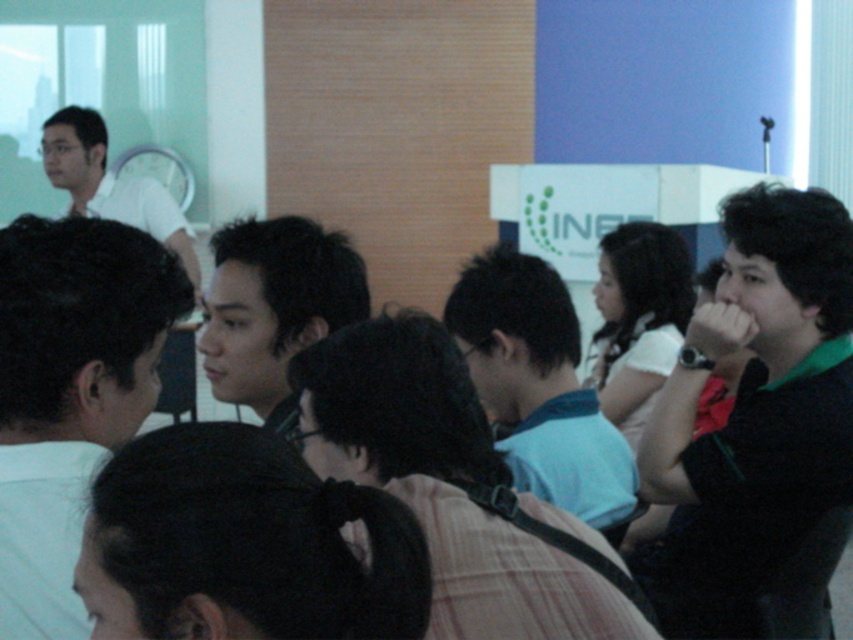
Question: Is black matte shirt at right positioned in front of blue cotton shirt at center?

Choices:
 (A) yes
 (B) no

Answer: (B)

Question: Which point is closer to the camera?

Choices:
 (A) (32, 467)
 (B) (660, 598)
 (C) (607, 508)
 (D) (341, 244)

Answer: (A)

Question: Is black matte shirt at right positioned in front of blue cotton shirt at center?

Choices:
 (A) no
 (B) yes

Answer: (A)

Question: Which point is closer to the camera?

Choices:
 (A) (241, 312)
 (B) (109, 198)

Answer: (A)

Question: Does blue cotton shirt at center appear on the right side of smooth black hair at center?

Choices:
 (A) no
 (B) yes

Answer: (B)

Question: Which point is farther to the camera?

Choices:
 (A) dark brown hair at left
 (B) black matte shirt at right
 (C) blue cotton shirt at center
 (D) white matte shirt at upper left

Answer: (D)